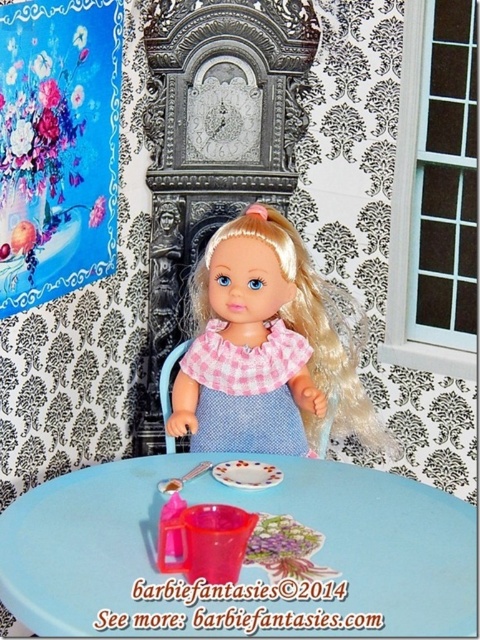
Question: Which point is farther to the camera?

Choices:
 (A) blue plastic table at center
 (B) pink checkered fabric doll at center
 (C) pink checkered fabric dress at center

Answer: (C)

Question: Is pink checkered fabric doll at center thinner than pink checkered fabric dress at center?

Choices:
 (A) no
 (B) yes

Answer: (A)

Question: Which point is farther to the camera?

Choices:
 (A) (288, 440)
 (B) (350, 465)

Answer: (A)

Question: Which is farther from the blue plastic table at center?

Choices:
 (A) pink checkered fabric doll at center
 (B) pink checkered fabric dress at center

Answer: (A)

Question: Does pink checkered fabric doll at center have a larger size compared to pink checkered fabric dress at center?

Choices:
 (A) yes
 (B) no

Answer: (A)

Question: Is pink checkered fabric doll at center above pink checkered fabric dress at center?

Choices:
 (A) no
 (B) yes

Answer: (A)